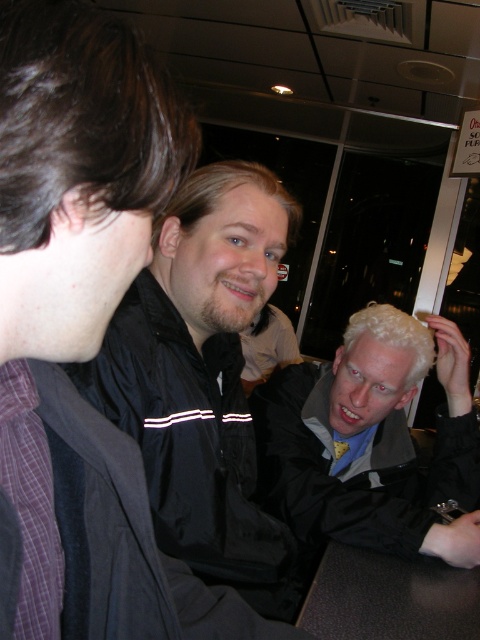
You are designing a layout for a magazine article about the scene. The article requires that the light brown hair at center and brown leather table at lower center must be placed side by side in the layout. Given their sizes, which object should be placed first to ensure proper spacing?

The light brown hair at center has a larger width than the brown leather table at lower center, so it should be placed first to ensure proper spacing.

You are a photographer trying to capture a clear shot of the black matte jacket at center and the light brown hair at center. Based on their sizes, which object would be easier to focus on and why?

The black matte jacket at center is bigger than the light brown hair at center, so it would be easier to focus on because larger objects are generally easier to capture clearly in a photograph.